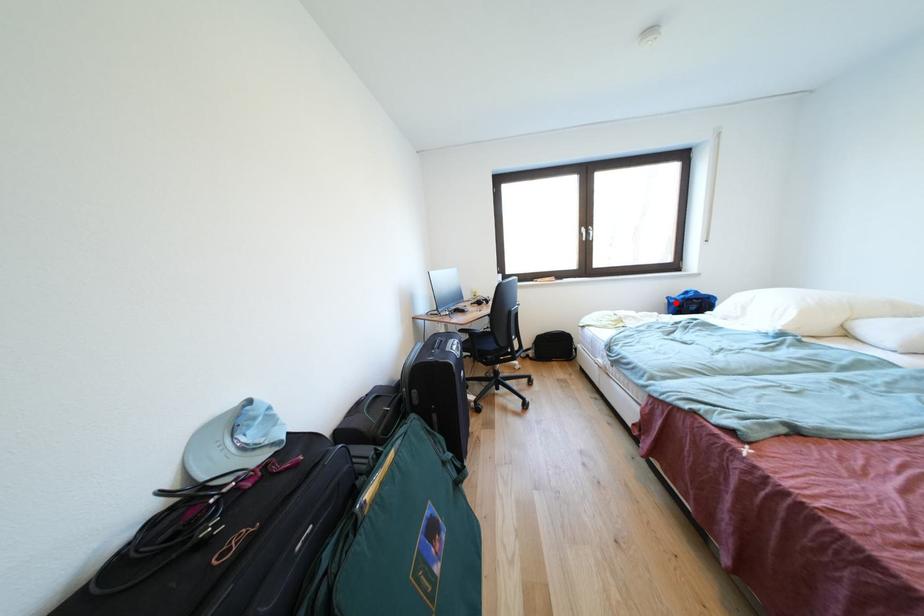
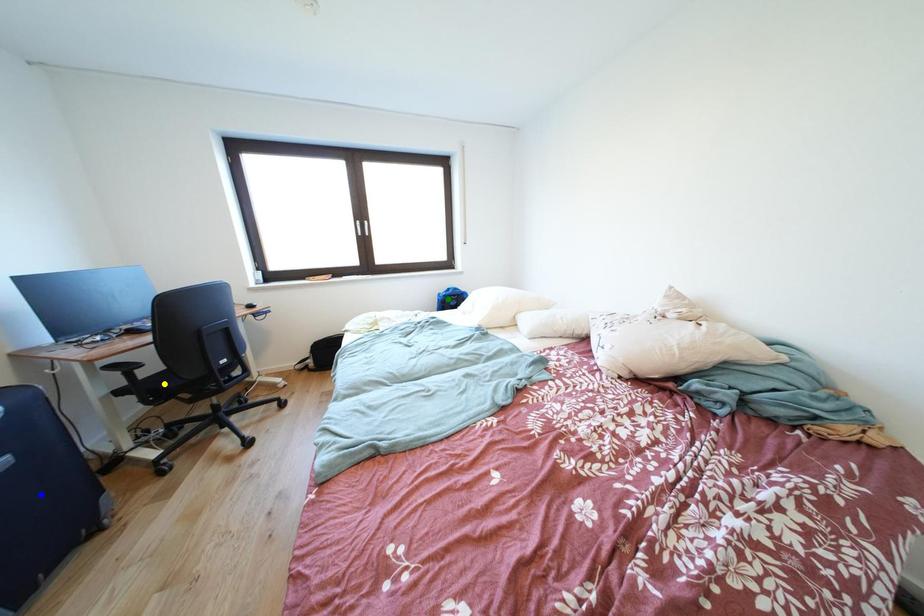
Question: I am providing you with two images of the same scene from different viewpoints. A red point is marked on the first image. You are given multiple points on the second image. Can you choose the point in image 2 that corresponds to the point in image 1?

Choices:
 (A) green point
 (B) yellow point
 (C) blue point

Answer: (A)